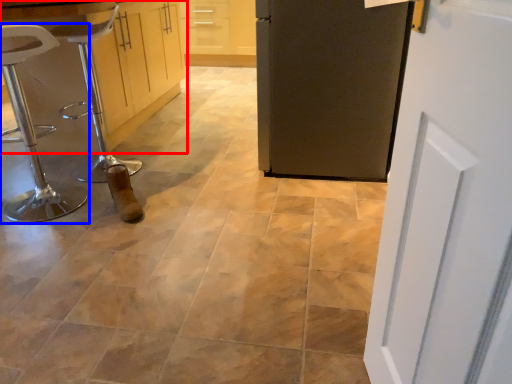
Question: Which of the following is the farthest to the observer, cabinetry (highlighted by a red box) or furniture (highlighted by a blue box)?

Choices:
 (A) cabinetry
 (B) furniture

Answer: (A)